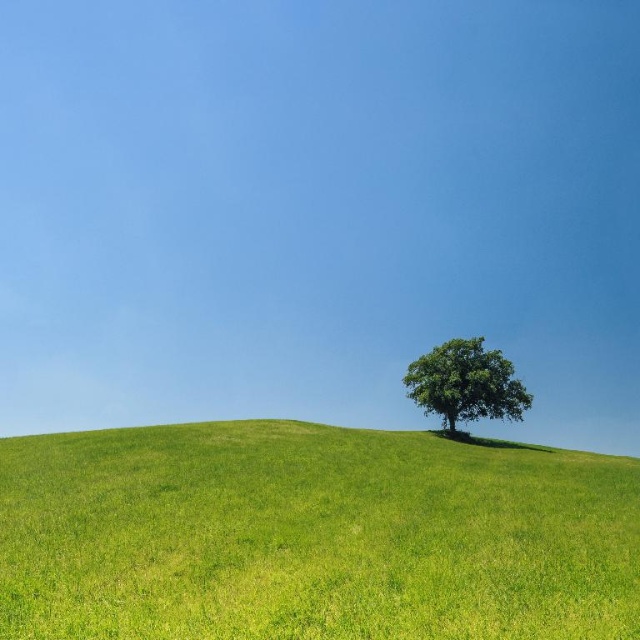
Which is in front, point (515, 621) or point (518, 387)?

Point (515, 621)

Which is in front, point (321, 548) or point (467, 397)?

Point (321, 548) is more forward.

Where is `green grassy hillside at center`? green grassy hillside at center is located at coordinates (312, 536).